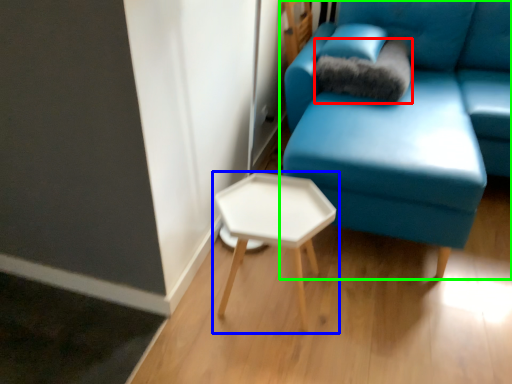
Question: Which object is the closest to the pillow (highlighted by a red box)? Choose among these: table (highlighted by a blue box) or studio couch (highlighted by a green box).

Choices:
 (A) table
 (B) studio couch

Answer: (B)